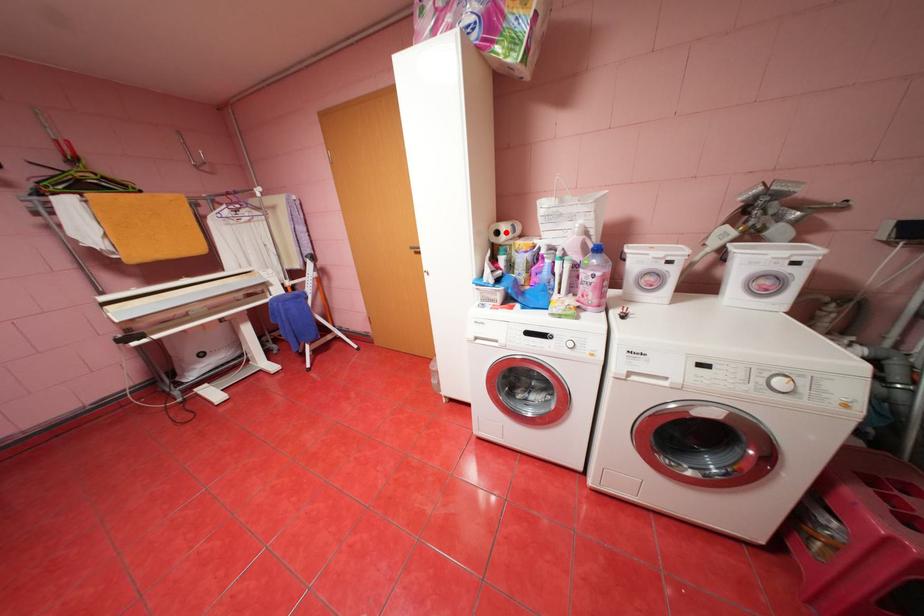
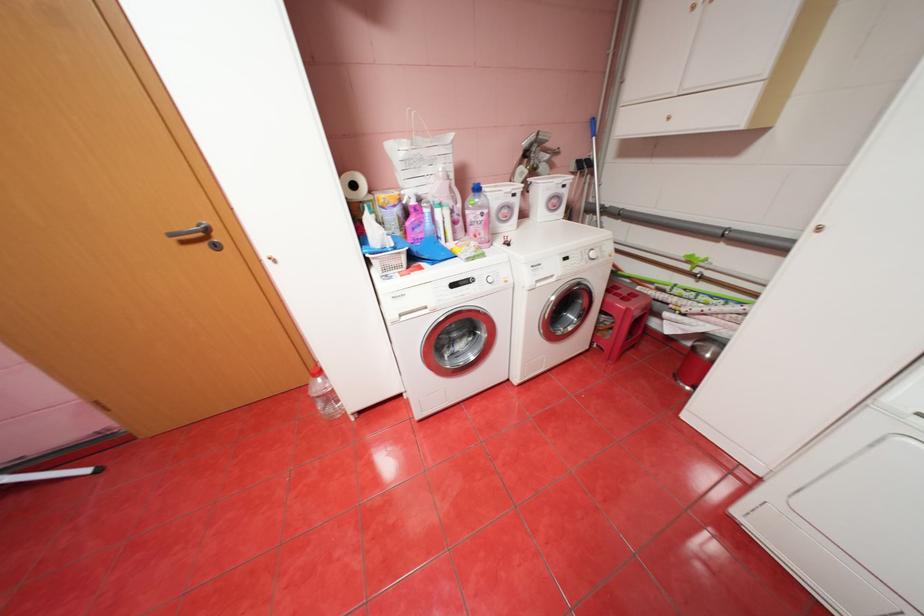
Locate, in the second image, the point that corresponds to the highlighted location in the first image.

(362, 185)